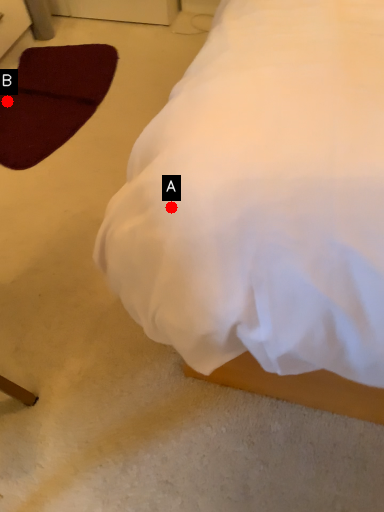
Question: Two points are circled on the image, labeled by A and B beside each circle. Which point is further to the camera?

Choices:
 (A) A is further
 (B) B is further

Answer: (B)